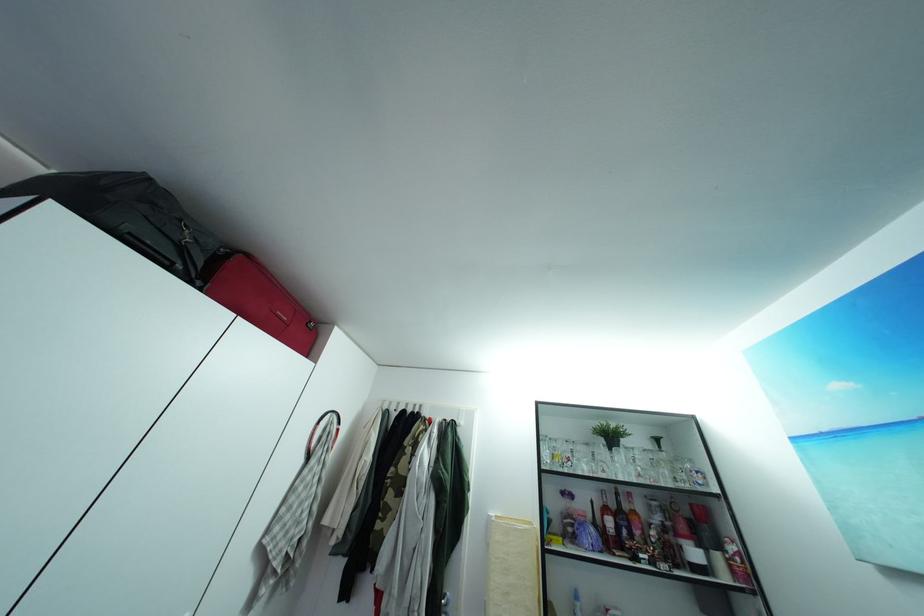
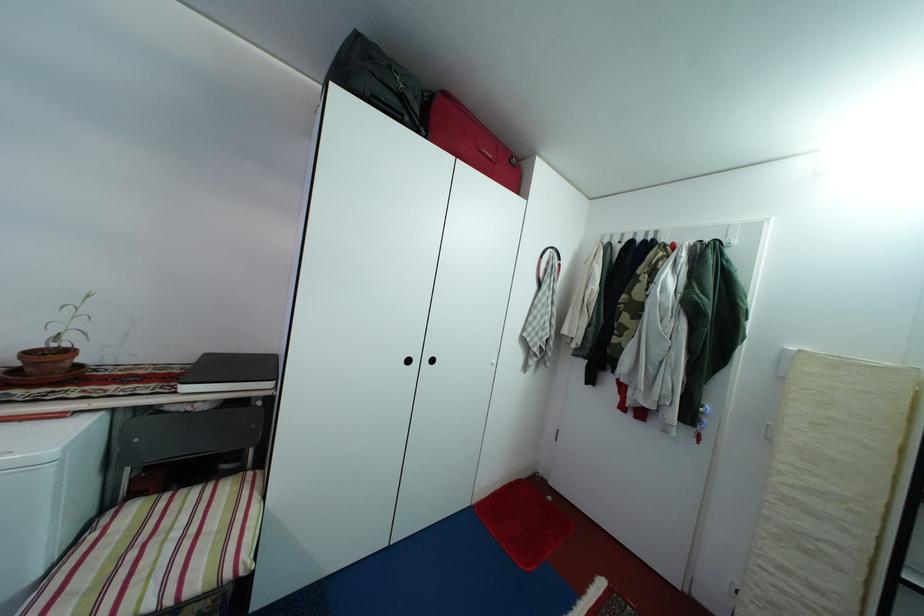
Based on the continuous images, in which direction is the camera rotating?

The rotation direction of the camera is left-down.